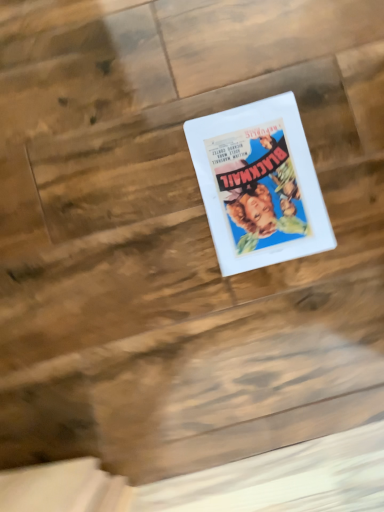
This screenshot has width=384, height=512. Describe the element at coordinates (259, 184) in the screenshot. I see `white glossy paperback book at center` at that location.

What is the approximate height of white glossy paperback book at center?

white glossy paperback book at center is 0.65 inches tall.

What is the approximate width of white glossy paperback book at center?

The width of white glossy paperback book at center is 32.56 centimeters.

Identify the location of white glossy paperback book at center. (259, 184).

Where is `white glossy paperback book at center`? The height and width of the screenshot is (512, 384). white glossy paperback book at center is located at coordinates (259, 184).